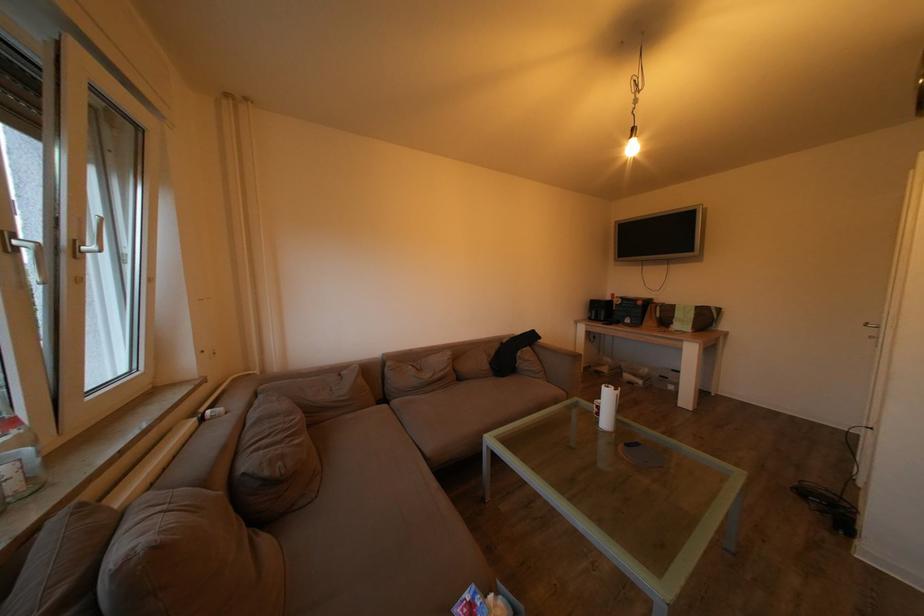
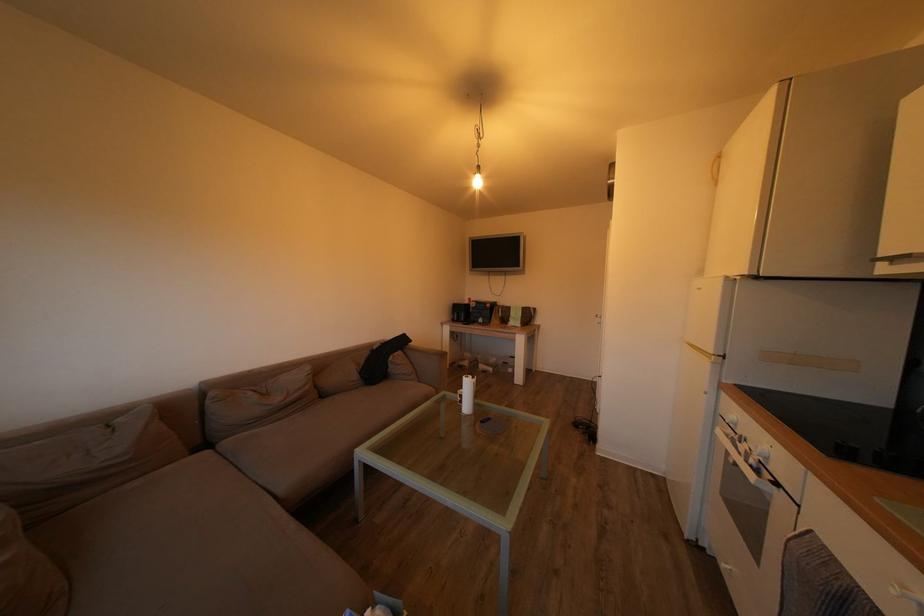
Locate, in the second image, the point that corresponds to [468,385] in the first image.

(331, 402)